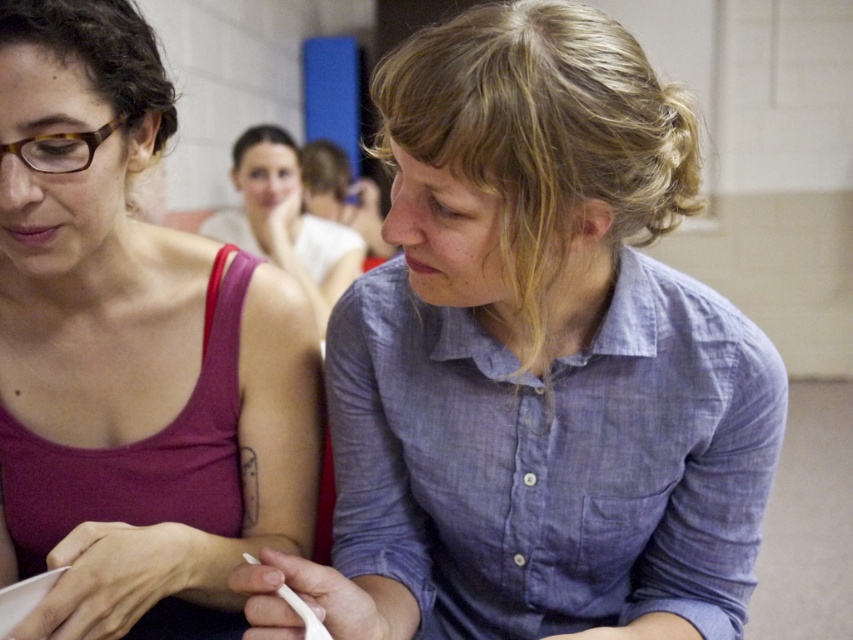
Looking at this image, you are a photographer setting up for a group photo. You need to ensure that the matte red tank top at left and the matte blue shirt at center are both in focus. The depth of field in your camera can cover objects within a 1.5 meter range. Will both subjects be in focus?

The matte red tank top at left is 1.72 meters away from the matte blue shirt at center. Since the depth of field only covers 1.5 meters, the distance between them exceeds this range, so both subjects cannot be in focus simultaneously.

You are an observer looking at the two individuals in the image. Both are wearing shirts described as blue cotton shirt at center and matte blue shirt at center. Which shirt is positioned lower on the person?

The blue cotton shirt at center is located below matte blue shirt at center, so the blue cotton shirt at center is positioned lower.